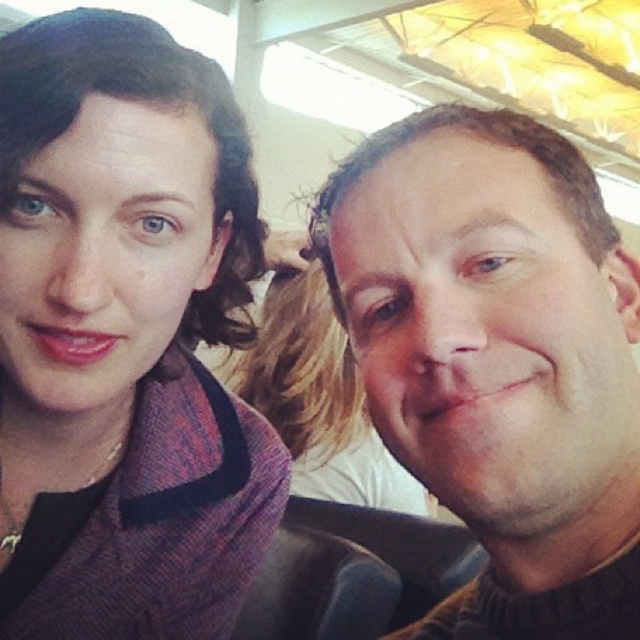
You are a photographer adjusting the lighting for a portrait. You need to place a spotlight at the point marked by the coordinates point (497,358). What object will the spotlight illuminate?

The spotlight at point (497,358) will illuminate the brown fuzzy sweater at right.

You are taking a selfie with two people. You notice a point at coordinates [124,337]. What object is located at that point?

The point at coordinates [124,337] indicates a matte purple scarf at upper left.